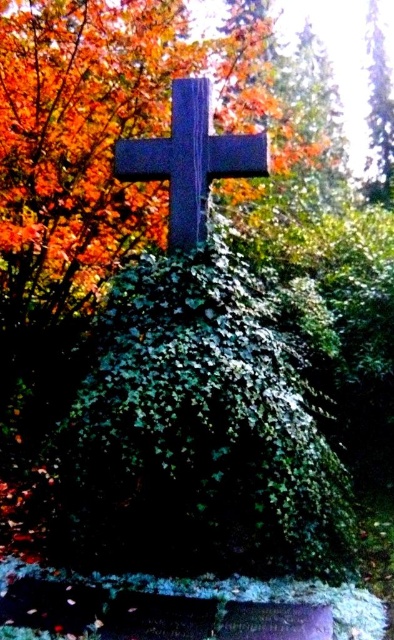
Question: Which point is farther from the camera taking this photo?

Choices:
 (A) (243, 173)
 (B) (377, 141)

Answer: (B)

Question: Among these points, which one is nearest to the camera?

Choices:
 (A) (176, 216)
 (B) (137, 397)

Answer: (B)

Question: Does dark gray stone cross at center appear under green leafy tree at upper right?

Choices:
 (A) yes
 (B) no

Answer: (A)

Question: Which is farther from the green leafy tree at upper right?

Choices:
 (A) green leafy bush at center
 (B) dark gray stone cross at center

Answer: (A)

Question: Observing the image, what is the correct spatial positioning of green leafy bush at center in reference to dark gray stone cross at center?

Choices:
 (A) above
 (B) below

Answer: (B)

Question: Does dark gray stone cross at center appear on the right side of green leafy tree at upper right?

Choices:
 (A) no
 (B) yes

Answer: (A)